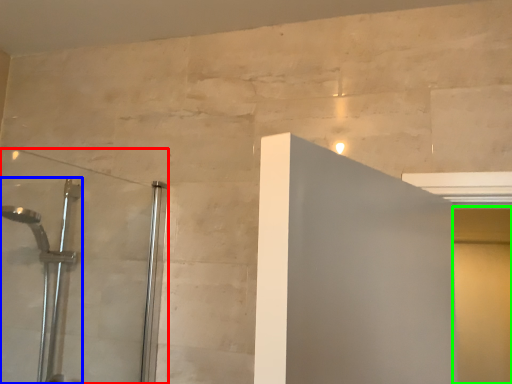
Question: Estimate the real-world distances between objects in this image. Which object is farther from shower door (highlighted by a red box), shower (highlighted by a blue box) or screen door (highlighted by a green box)?

Choices:
 (A) shower
 (B) screen door

Answer: (B)